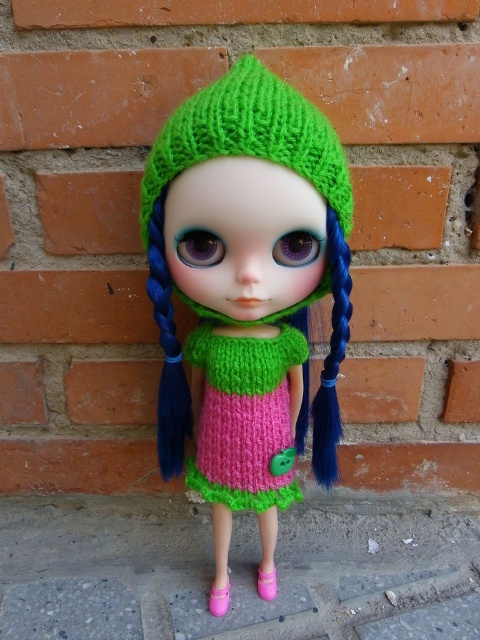
The width and height of the screenshot is (480, 640). I want to click on green knitted doll at center, so click(x=247, y=291).

Which of these two, green knitted doll at center or bluehairpigtail at center, stands shorter?

bluehairpigtail at center is shorter.

What do you see at coordinates (247, 291) in the screenshot?
I see `green knitted doll at center` at bounding box center [247, 291].

Where is `green knitted doll at center`? The height and width of the screenshot is (640, 480). green knitted doll at center is located at coordinates (247, 291).

Does green knitted hat at center have a greater height compared to bluehairpigtail at right?

No.

Does point (179, 134) come farther from viewer compared to point (336, 470)?

No, it is in front of (336, 470).

This screenshot has width=480, height=640. I want to click on green knitted hat at center, so click(249, 138).

Between green knitted doll at center and bluehairpigtail at right, which one is positioned higher?

green knitted doll at center is above.

Between point (261, 161) and point (335, 307), which one is positioned in front?

Point (261, 161)

Find the location of `green knitted doll at center`. green knitted doll at center is located at coordinates (247, 291).